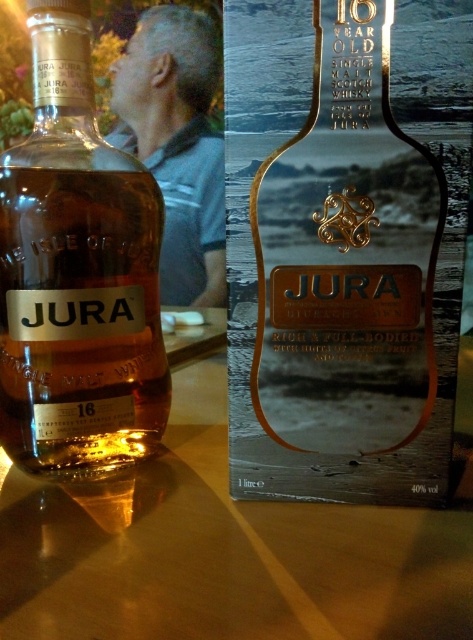
Question: Which of the following is the closest to the observer?

Choices:
 (A) matte glass bottle at center
 (B) gold metallic bottle at center

Answer: (B)

Question: Is gold metallic bottle at center below matte glass bottle at center?

Choices:
 (A) yes
 (B) no

Answer: (A)

Question: In this image, where is gold metallic bottle at center located relative to matte glass bottle at center?

Choices:
 (A) above
 (B) below

Answer: (B)

Question: Which point appears farthest from the camera in this image?

Choices:
 (A) (307, 468)
 (B) (120, 180)

Answer: (B)

Question: Can you confirm if gold metallic bottle at center is wider than matte glass bottle at center?

Choices:
 (A) no
 (B) yes

Answer: (B)

Question: Which object is closer to the camera taking this photo?

Choices:
 (A) matte glass bottle at center
 (B) gold metallic bottle at center

Answer: (B)